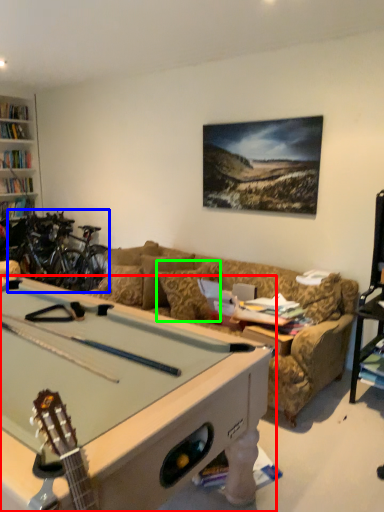
Question: Which object is the closest to the billiard table (highlighted by a red box)? Choose among these: bicycle (highlighted by a blue box) or pillow (highlighted by a green box).

Choices:
 (A) bicycle
 (B) pillow

Answer: (B)